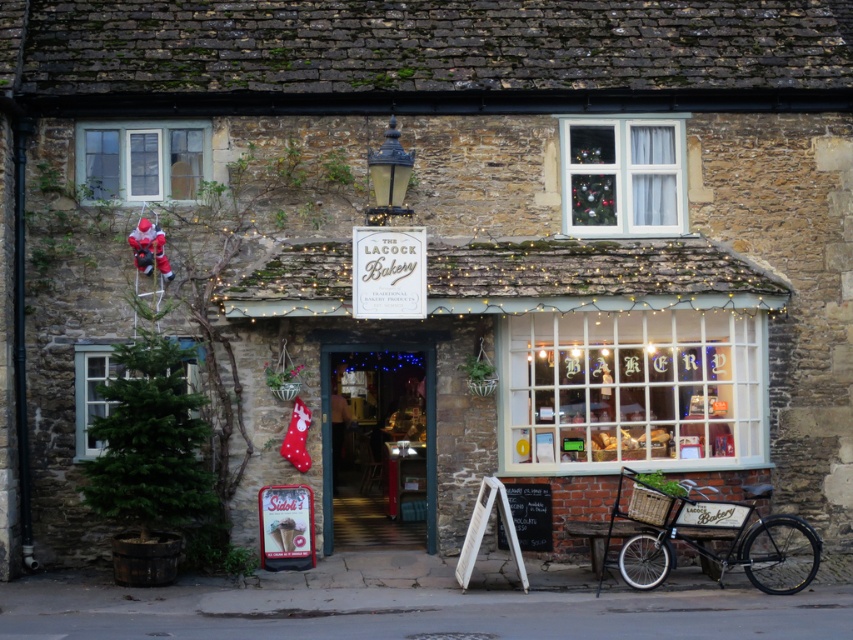
Is white frosted glass bakery sign at center to the left of clear glass window at upper left from the viewer's perspective?

In fact, white frosted glass bakery sign at center is to the right of clear glass window at upper left.

I want to click on white frosted glass bakery sign at center, so click(635, 388).

Based on the photo, can you confirm if matte white bakery at center is positioned above clear glass window at upper left?

No, matte white bakery at center is not above clear glass window at upper left.

Can you confirm if matte white bakery at center is wider than clear glass window at upper left?

Yes.

Who is more distant from viewer, (x=686, y=353) or (x=78, y=168)?

The point (x=686, y=353) is more distant.

This screenshot has width=853, height=640. I want to click on matte white bakery at center, so click(546, 358).

Which of these two, matte white bakery at center or green matte christmas tree at lower left, stands taller?

matte white bakery at center is taller.

Is matte white bakery at center thinner than green matte christmas tree at lower left?

No, matte white bakery at center is not thinner than green matte christmas tree at lower left.

Is point (363, 387) positioned behind point (82, 435)?

Yes, it is.

Locate an element on the screen. matte white bakery at center is located at coordinates (546, 358).